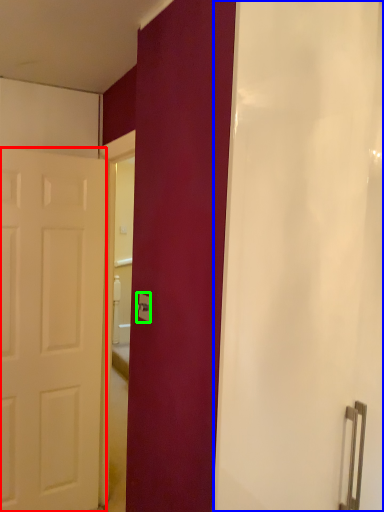
Question: Considering the real-world distances, which object is farthest from door (highlighted by a red box)? shower curtain (highlighted by a blue box) or electric outlet (highlighted by a green box)?

Choices:
 (A) shower curtain
 (B) electric outlet

Answer: (A)